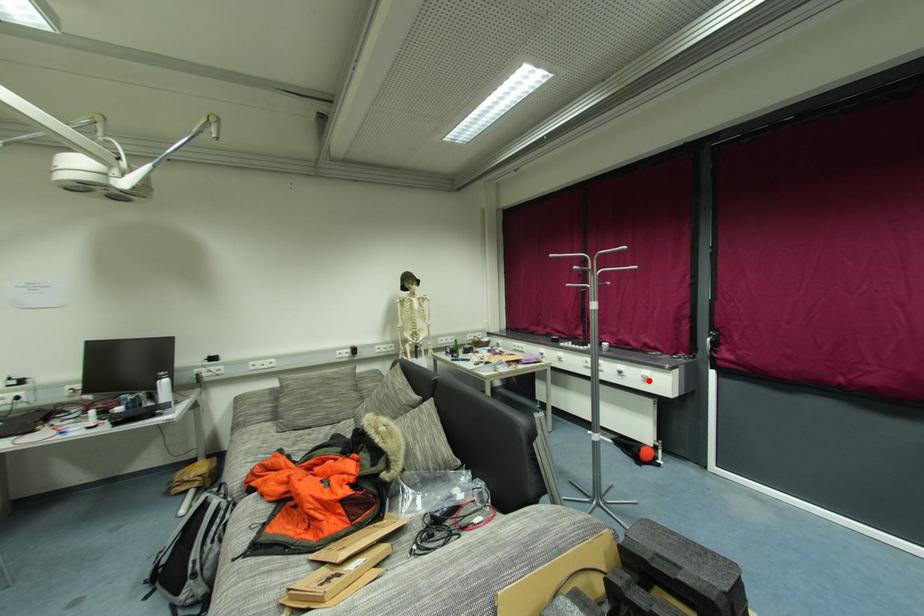
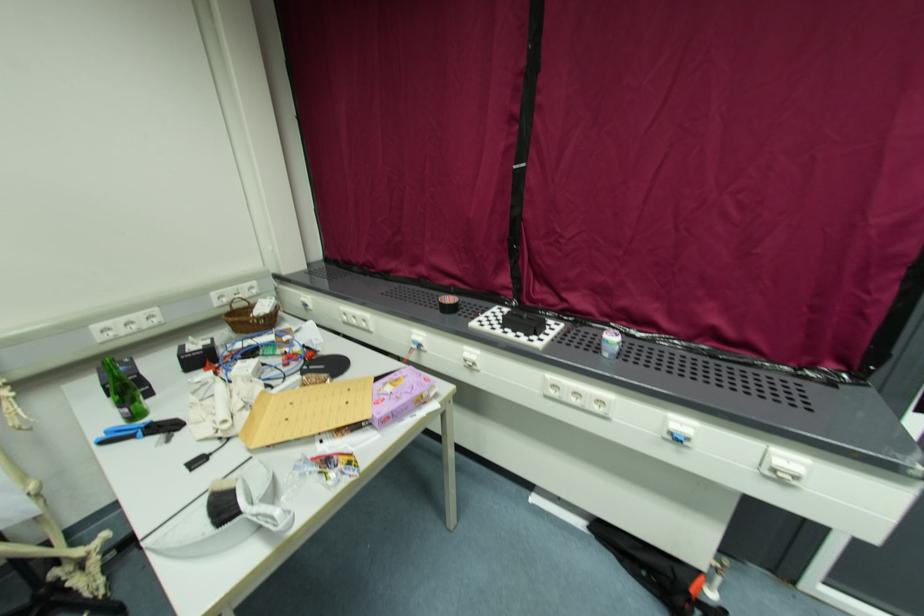
Find the pixel in the second image that matches the highlighted location in the first image.

(783, 477)